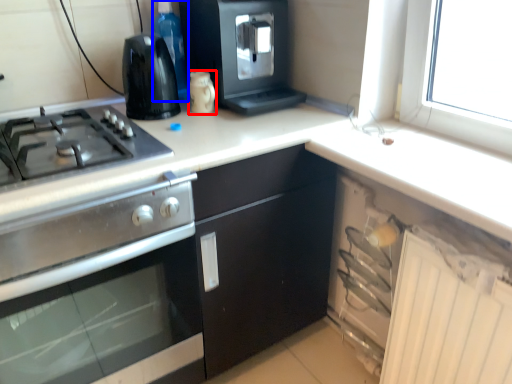
Question: Among these objects, which one is nearest to the camera, kitchen appliance (highlighted by a red box) or bottle (highlighted by a blue box)?

Choices:
 (A) kitchen appliance
 (B) bottle

Answer: (A)